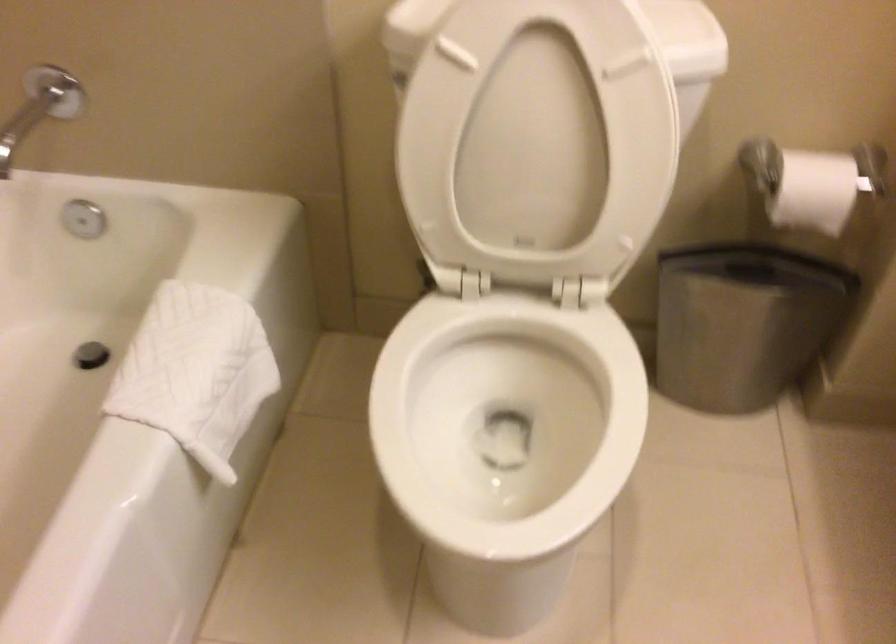
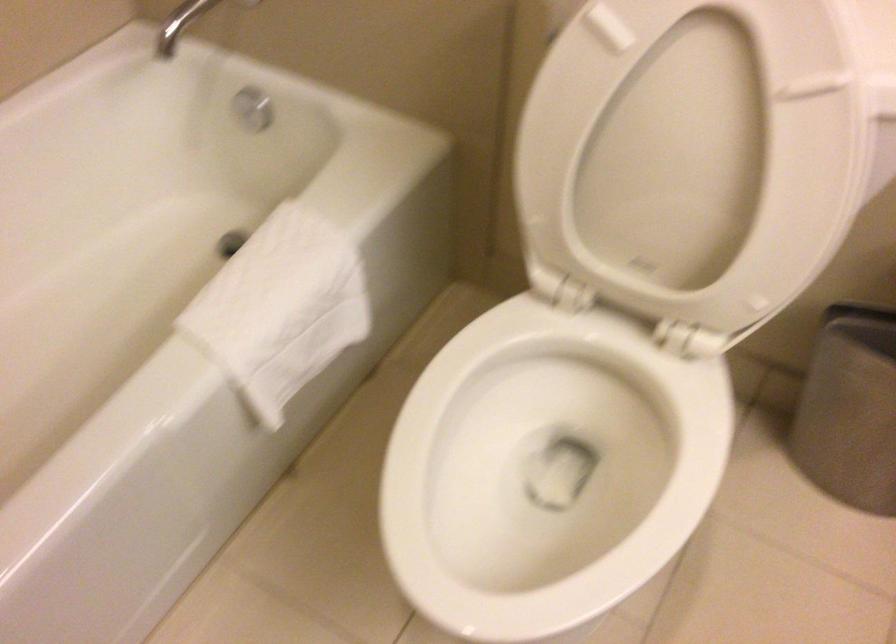
Locate, in the second image, the point that corresponds to pixel 203 366 in the first image.

(282, 303)